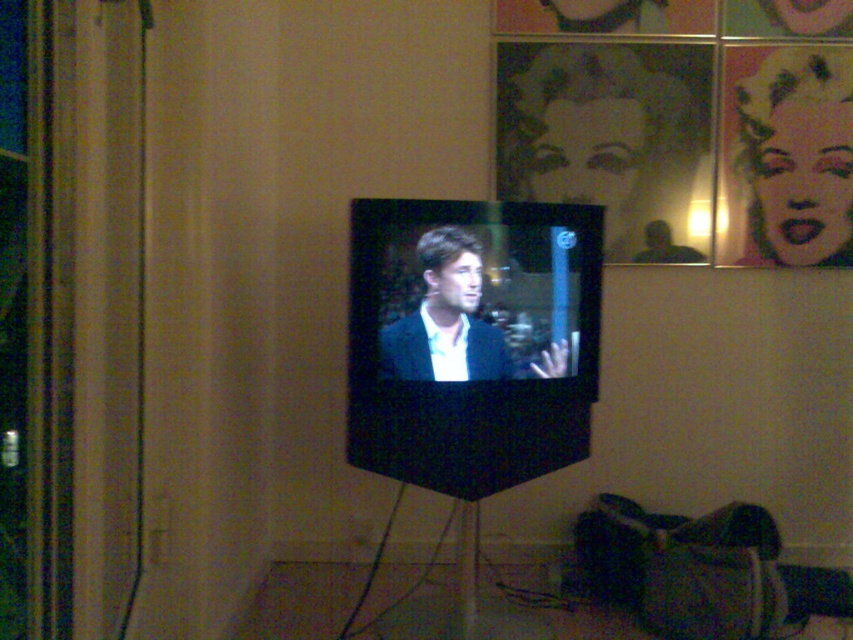
Question: Can you confirm if metallic silver portrait at upper center is positioned to the left of matte black portrait at upper right?

Choices:
 (A) yes
 (B) no

Answer: (A)

Question: Estimate the real-world distances between objects in this image. Which object is closer to the matte black suit at center?

Choices:
 (A) metallic silver portrait at upper center
 (B) matte black portrait at upper right

Answer: (A)

Question: Is matte black portrait at upper right positioned at the back of matte black suit at center?

Choices:
 (A) no
 (B) yes

Answer: (B)

Question: Can you confirm if metallic silver portrait at upper center is positioned below matte black portrait at upper right?

Choices:
 (A) yes
 (B) no

Answer: (B)

Question: Which point is closer to the camera?

Choices:
 (A) matte black suit at center
 (B) matte black portrait at upper right
 (C) metallic silver portrait at upper center

Answer: (A)

Question: Which object is the farthest from the matte black suit at center?

Choices:
 (A) metallic silver portrait at upper center
 (B) matte black portrait at upper right

Answer: (B)